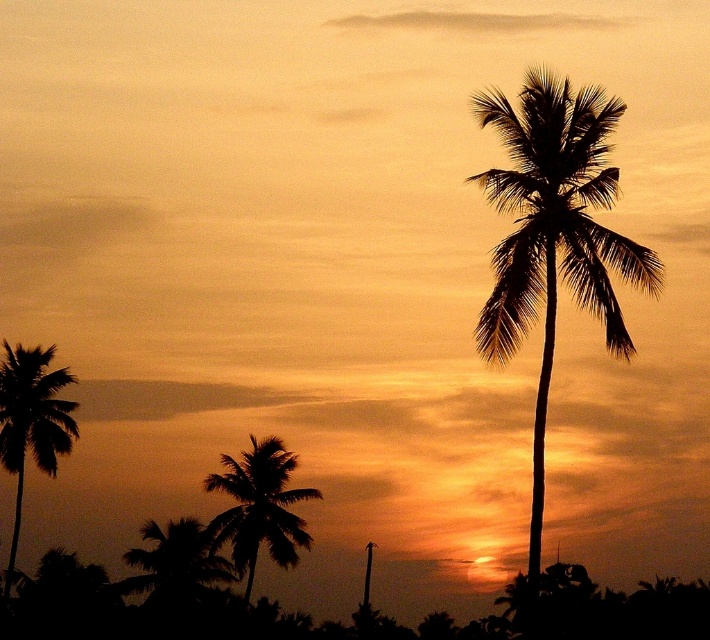
From the picture: You are standing at the center of the scene and want to find the silhouette leafy palm at lower center. According to the coordinates given, in which direction should you look to locate it?

The silhouette leafy palm at lower center is located at coordinates point (258, 508), so you should look to the lower right direction to locate it.

You are an artist trying to paint the sunset scene. You have to decide which palm tree to paint first based on their sizes. Which one should you start with, the silhouette palm at right or the silhouette leafy palm at lower center?

You should start with the silhouette palm at right because it is bigger than the silhouette leafy palm at lower center.